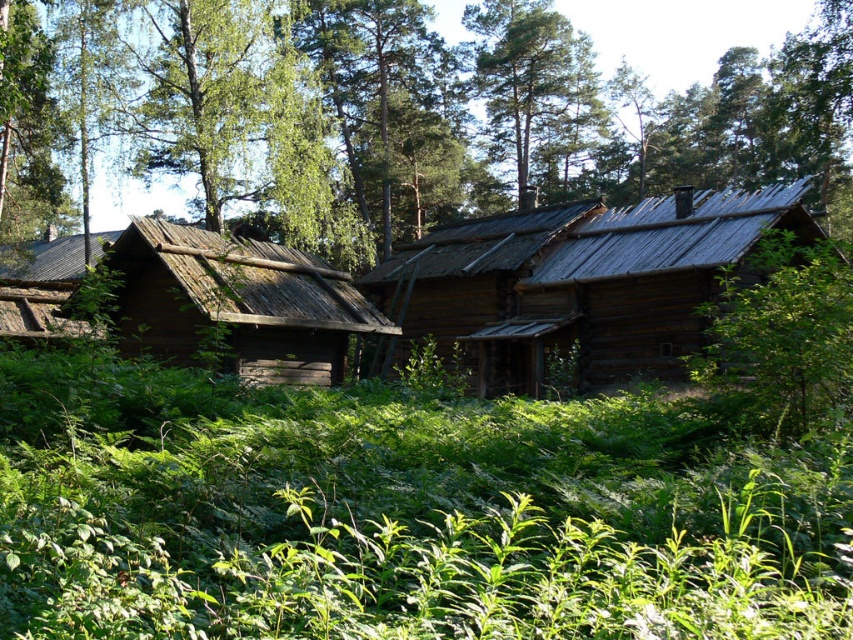
Between green leafy tree at upper center and brown wooden cabin at center, which one is positioned higher?

Positioned higher is green leafy tree at upper center.

Find the location of `green leafy tree at upper center`. green leafy tree at upper center is located at coordinates (392, 115).

Is wooden log cabin at center positioned before brown wooden cabin at center?

No, wooden log cabin at center is behind brown wooden cabin at center.

Is wooden log cabin at center above brown wooden cabin at center?

Correct, wooden log cabin at center is located above brown wooden cabin at center.

What do you see at coordinates (579, 282) in the screenshot?
I see `wooden log cabin at center` at bounding box center [579, 282].

Identify the location of wooden log cabin at center. This screenshot has width=853, height=640. (579, 282).

Is point (142, 525) positioned behind point (263, 369)?

No, (142, 525) is closer to viewer.

Does green leafy grass at center lie behind brown wooden cabin at center?

No.

What do you see at coordinates (401, 513) in the screenshot?
I see `green leafy grass at center` at bounding box center [401, 513].

This screenshot has height=640, width=853. I want to click on green leafy grass at center, so click(401, 513).